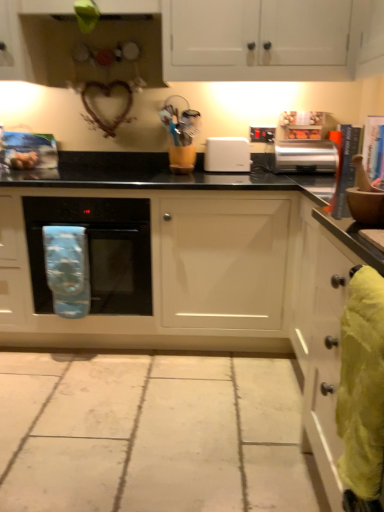
The image size is (384, 512). I want to click on white plastic toaster at center, so click(227, 155).

Image resolution: width=384 pixels, height=512 pixels. Describe the element at coordinates (97, 250) in the screenshot. I see `black glass microwave at center` at that location.

In order to click on blue fabric oven mitt at left, acting as the first material starting from the back in this screenshot , I will do `click(67, 269)`.

What do you see at coordinates (158, 271) in the screenshot? This screenshot has width=384, height=512. I see `white matte cabinet at center, acting as the second cabinetry starting from the top` at bounding box center [158, 271].

Describe the element at coordinates (264, 38) in the screenshot. I see `white matte cabinet at upper center, the first cabinetry from the top` at that location.

How much space does white matte cabinet at upper center, which is counted as the 3th cabinetry, starting from the bottom, occupy horizontally?

white matte cabinet at upper center, which is counted as the 3th cabinetry, starting from the bottom, is 42.06 centimeters in width.

Image resolution: width=384 pixels, height=512 pixels. What do you see at coordinates (306, 156) in the screenshot? I see `satin silver toaster at upper right` at bounding box center [306, 156].

Identify the location of satin silver toaster at upper right. (306, 156).

Locate an element on the screen. Image resolution: width=384 pixels, height=512 pixels. yellow fabric towel at right, the 1th material positioned from the front is located at coordinates (362, 393).

Is black glass microwave at center taller or shorter than yellow fabric towel at right, the second material from the left?

black glass microwave at center is taller than yellow fabric towel at right, the second material from the left.

From a real-world perspective, who is located lower, black glass microwave at center or yellow fabric towel at right, marked as the 1th material in a right-to-left arrangement?

black glass microwave at center, from a real-world perspective.

Between black glass microwave at center and yellow fabric towel at right, the second material from the left, which one has smaller width?

yellow fabric towel at right, the second material from the left.

Is point (107, 297) behind point (348, 494)?

Yes, it is.

Between black glass microwave at center and blue fabric oven mitt at left, acting as the first material starting from the back, which one appears on the right side from the viewer's perspective?

Positioned to the right is black glass microwave at center.

Is black glass microwave at center oriented away from blue fabric oven mitt at left, acting as the first material starting from the back?

No.

In terms of width, does black glass microwave at center look wider or thinner when compared to blue fabric oven mitt at left, which is counted as the second material, starting from the front?

Clearly, black glass microwave at center has more width compared to blue fabric oven mitt at left, which is counted as the second material, starting from the front.

From their relative heights in the image, would you say satin silver toaster at upper right is taller or shorter than black glass microwave at center?

Clearly, satin silver toaster at upper right is shorter compared to black glass microwave at center.

Looking at this image, from a real-world perspective, which object stands above the other?

In real-world perspective, satin silver toaster at upper right is above.

Is satin silver toaster at upper right to the left of black glass microwave at center from the viewer's perspective?

In fact, satin silver toaster at upper right is to the right of black glass microwave at center.

Who is bigger, satin silver toaster at upper right or black glass microwave at center?

black glass microwave at center is bigger.

Is blue fabric oven mitt at left, which ranks as the 2th material in right-to-left order, oriented away from white glossy cabinet at right, which appears as the third cabinetry when viewed from the top?

No, white glossy cabinet at right, which appears as the third cabinetry when viewed from the top, is not at the back of blue fabric oven mitt at left, which ranks as the 2th material in right-to-left order.

At what (x,y) coordinates should I click in order to perform the action: click on material that is the 2nd object to the left of the white glossy cabinet at right, the first cabinetry in the bottom-to-top sequence, starting at the anchor. Please return your answer as a coordinate pair (x, y). Looking at the image, I should click on (67, 269).

Who is taller, blue fabric oven mitt at left, which is counted as the second material, starting from the front, or white glossy cabinet at right, which appears as the third cabinetry when viewed from the top?

white glossy cabinet at right, which appears as the third cabinetry when viewed from the top.

Is blue fabric oven mitt at left, which is counted as the second material, starting from the front, positioned far away from white glossy cabinet at right, the first cabinetry in the bottom-to-top sequence?

Absolutely, blue fabric oven mitt at left, which is counted as the second material, starting from the front, is distant from white glossy cabinet at right, the first cabinetry in the bottom-to-top sequence.

Which cabinetry is the 1st one when counting from the left side of the white plastic toaster at center? Please provide its 2D coordinates.

[(264, 38)]

Could you tell me if white plastic toaster at center is facing white matte cabinet at upper center, the first cabinetry from the top?

No, white plastic toaster at center is not turned towards white matte cabinet at upper center, the first cabinetry from the top.

Which of these two, white plastic toaster at center or white matte cabinet at upper center, the first cabinetry from the top, is smaller?

With smaller size is white plastic toaster at center.

Are white plastic toaster at center and white matte cabinet at upper center, which is counted as the 3th cabinetry, starting from the bottom, beside each other?

There is a gap between white plastic toaster at center and white matte cabinet at upper center, which is counted as the 3th cabinetry, starting from the bottom.

Can you confirm if white matte cabinet at upper center, the first cabinetry from the top, is positioned to the right of black glass microwave at center?

Correct, you'll find white matte cabinet at upper center, the first cabinetry from the top, to the right of black glass microwave at center.

Does white matte cabinet at upper center, which is counted as the 3th cabinetry, starting from the bottom, touch black glass microwave at center?

No, white matte cabinet at upper center, which is counted as the 3th cabinetry, starting from the bottom, is not beside black glass microwave at center.

This screenshot has height=512, width=384. What are the coordinates of `cabinetry lying above the black glass microwave at center (from the image's perspective)` in the screenshot? It's located at [x=264, y=38].

How many degrees apart are the facing directions of white matte cabinet at upper center, the first cabinetry from the top, and blue fabric oven mitt at left, which is counted as the second material, starting from the front?

The facing directions of white matte cabinet at upper center, the first cabinetry from the top, and blue fabric oven mitt at left, which is counted as the second material, starting from the front, are 2.05 degrees apart.

Is white matte cabinet at upper center, the first cabinetry from the top, to the right of blue fabric oven mitt at left, which is the first material from left to right, from the viewer's perspective?

Correct, you'll find white matte cabinet at upper center, the first cabinetry from the top, to the right of blue fabric oven mitt at left, which is the first material from left to right.

Looking at their sizes, would you say white matte cabinet at upper center, the first cabinetry from the top, is wider or thinner than blue fabric oven mitt at left, which ranks as the 2th material in right-to-left order?

In the image, white matte cabinet at upper center, the first cabinetry from the top, appears to be wider than blue fabric oven mitt at left, which ranks as the 2th material in right-to-left order.

Is point (143, 5) positioned after point (85, 258)?

Yes, it is behind point (85, 258).

You are a GUI agent. You are given a task and a screenshot of the screen. Output one action in this format:
    pyautogui.click(x=<x>, y=<y>)
    Task: Click on the 2nd material below when counting from the black glass microwave at center (from the image's perspective)
    The width and height of the screenshot is (384, 512).
    Given the screenshot: What is the action you would take?
    click(x=362, y=393)

Locate an element on the screen. home appliance that is on the right side of blue fabric oven mitt at left, acting as the first material starting from the back is located at coordinates (97, 250).

Looking at the image, which one is located further to black glass microwave at center, blue fabric oven mitt at left, which ranks as the 2th material in right-to-left order, or white matte cabinet at upper center, which is counted as the 3th cabinetry, starting from the bottom?

white matte cabinet at upper center, which is counted as the 3th cabinetry, starting from the bottom, lies further to black glass microwave at center than the other object.

Considering their positions, is white glossy cabinet at right, the first cabinetry in the bottom-to-top sequence, positioned further to yellow fabric towel at right, the 1th material positioned from the front, than white plastic toaster at center?

white plastic toaster at center is positioned further to the anchor yellow fabric towel at right, the 1th material positioned from the front.

Based on their spatial positions, is white matte cabinet at center, the second cabinetry ordered from the bottom, or satin silver toaster at upper right further from yellow fabric towel at right, the second material from the left?

The object further to yellow fabric towel at right, the second material from the left, is satin silver toaster at upper right.

Estimate the real-world distances between objects in this image. Which object is closer to white matte cabinet at center, the second cabinetry ordered from the bottom, black glass microwave at center or blue fabric oven mitt at left, which is the first material from left to right?

Among the two, black glass microwave at center is located nearer to white matte cabinet at center, the second cabinetry ordered from the bottom.

Consider the image. Based on their spatial positions, is white glossy cabinet at right, the first cabinetry in the bottom-to-top sequence, or blue fabric oven mitt at left, acting as the first material starting from the back, closer to white matte cabinet at upper center, which is counted as the 3th cabinetry, starting from the bottom?

white glossy cabinet at right, the first cabinetry in the bottom-to-top sequence.

Which object lies further to the anchor point yellow fabric towel at right, which appears as the second material when viewed from the back, white plastic toaster at center or blue fabric oven mitt at left, acting as the first material starting from the back?

white plastic toaster at center.

From the image, which object appears to be farther from white plastic toaster at center, white matte cabinet at upper center, the first cabinetry from the top, or white matte cabinet at center, acting as the second cabinetry starting from the top?

Based on the image, white matte cabinet at center, acting as the second cabinetry starting from the top, appears to be further to white plastic toaster at center.

Which object lies further to the anchor point yellow fabric towel at right, the 1th material positioned from the front, blue fabric oven mitt at left, which ranks as the 2th material in right-to-left order, or white glossy cabinet at right, the first cabinetry in the bottom-to-top sequence?

The object further to yellow fabric towel at right, the 1th material positioned from the front, is blue fabric oven mitt at left, which ranks as the 2th material in right-to-left order.

This screenshot has width=384, height=512. In order to click on home appliance between yellow fabric towel at right, the second material from the left, and satin silver toaster at upper right, along the z-axis in this screenshot , I will do pyautogui.click(x=97, y=250).

Identify the location of home appliance between yellow fabric towel at right, marked as the 1th material in a right-to-left arrangement, and white plastic toaster at center, along the z-axis. The width and height of the screenshot is (384, 512). (97, 250).

Where is `cabinetry between white matte cabinet at upper center, which is counted as the 3th cabinetry, starting from the bottom, and white glossy cabinet at right, which appears as the third cabinetry when viewed from the top, vertically`? The width and height of the screenshot is (384, 512). cabinetry between white matte cabinet at upper center, which is counted as the 3th cabinetry, starting from the bottom, and white glossy cabinet at right, which appears as the third cabinetry when viewed from the top, vertically is located at coordinates (158, 271).

You are a GUI agent. You are given a task and a screenshot of the screen. Output one action in this format:
    pyautogui.click(x=<x>, y=<y>)
    Task: Click on the material between yellow fabric towel at right, which appears as the second material when viewed from the back, and white plastic toaster at center in the front-back direction
    This screenshot has height=512, width=384.
    Given the screenshot: What is the action you would take?
    pyautogui.click(x=67, y=269)